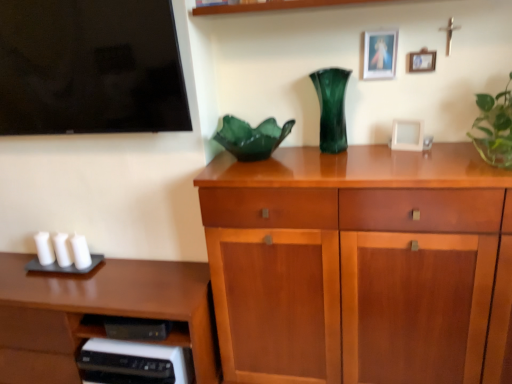
Question: Considering their positions, is matte gold picture frame at upper right, the first picture frame from the top, located in front of or behind green glass vase at center?

Choices:
 (A) front
 (B) behind

Answer: (B)

Question: From the image's perspective, is matte gold picture frame at upper right, the 3th picture frame ordered from the bottom, above or below green glass vase at center?

Choices:
 (A) above
 (B) below

Answer: (A)

Question: Considering the real-world distances, which object is closest to the brown wood desk at lower left?

Choices:
 (A) white matte candle at left, which is the 2th candle in right-to-left order
 (B) green glass vase at center
 (C) green glossy plant at right, which is the second houseplant in left-to-right order
 (D) white matte candle at lower left, the 3th candle in the right-to-left sequence
 (E) wooden cabinet at center

Answer: (A)

Question: Which object is the closest to the wooden cabinet at center?

Choices:
 (A) white matte candle at lower left, which appears as the first candle when viewed from the left
 (B) white matte picture frame at upper right, marked as the 1th picture frame in a bottom-to-top arrangement
 (C) green glossy plant at right, arranged as the 1th houseplant when viewed from the right
 (D) green glass vase at center
 (E) matte gold picture frame at upper right, the first picture frame from the top

Answer: (D)